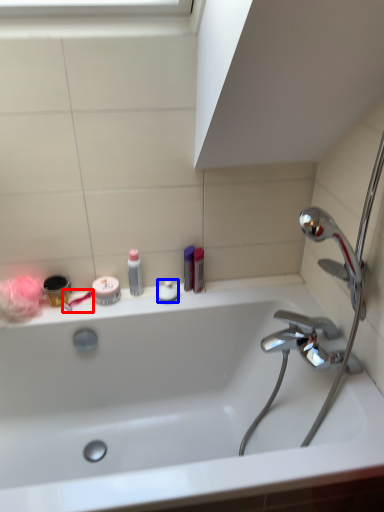
Question: Which object appears farthest to the camera in this image, toothbrush (highlighted by a red box) or toiletry (highlighted by a blue box)?

Choices:
 (A) toothbrush
 (B) toiletry

Answer: (B)